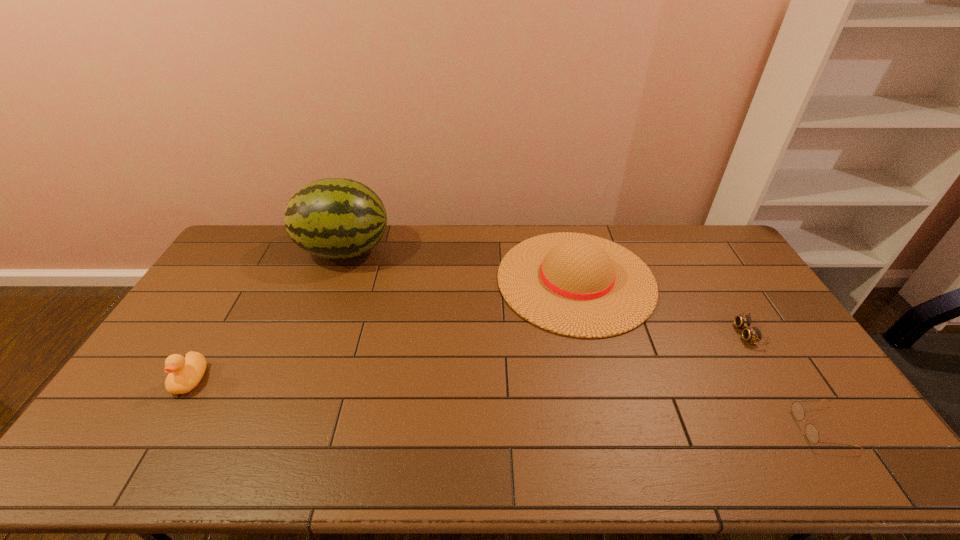
This screenshot has width=960, height=540. Find the location of `object present at the left edge`. object present at the left edge is located at coordinates (184, 375).

The height and width of the screenshot is (540, 960). What are the coordinates of `goggles that is at the right edge` in the screenshot? It's located at (753, 334).

Where is `spectacles present at the right edge`? The image size is (960, 540). spectacles present at the right edge is located at coordinates (811, 432).

This screenshot has height=540, width=960. Identify the location of object that is positioned at the near right corner. (811, 432).

You are a GUI agent. You are given a task and a screenshot of the screen. Output one action in this format:
    pyautogui.click(x=<x>, y=<y>)
    Task: Click on the vacant point at the far edge
    The width and height of the screenshot is (960, 540).
    Given the screenshot: What is the action you would take?
    pyautogui.click(x=522, y=233)

Identify the location of vacant area at the near edge of the desktop. This screenshot has width=960, height=540. (276, 455).

At what (x,y) coordinates should I click in order to perform the action: click on free region at the left edge. Please return your answer as a coordinate pair (x, y). The height and width of the screenshot is (540, 960). Looking at the image, I should click on (167, 415).

Locate an element on the screen. vacant space at the right edge of the desktop is located at coordinates (780, 379).

In the image, there is a desktop. Where is `vacant space at the far right corner`? Image resolution: width=960 pixels, height=540 pixels. vacant space at the far right corner is located at coordinates (685, 237).

The height and width of the screenshot is (540, 960). In order to click on free region at the near right corner of the desktop in this screenshot , I will do `click(855, 463)`.